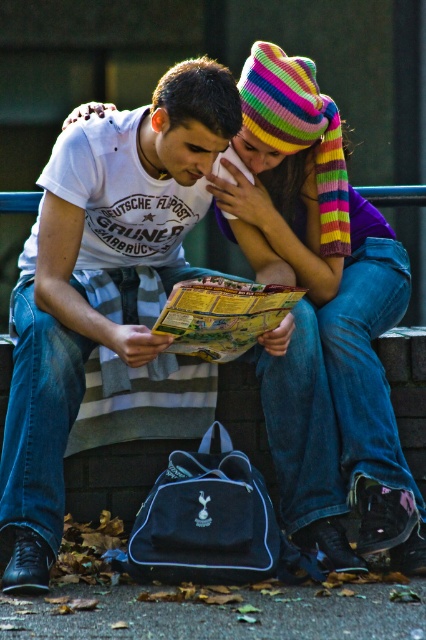
You are a tourist trying to navigate the city. You see the knitted woolen hat at upper center and the yellow paper map at center. Which object is positioned to the right of the other?

The knitted woolen hat at upper center is to the right of the yellow paper map at center.

You are a delivery person trying to read the yellow paper map at center while the person wearing the knitted woolen hat at upper center is leaning over it. Will the hat block your view of the map?

The knitted woolen hat at upper center is wider than the yellow paper map at center, so it may block your view of the map.